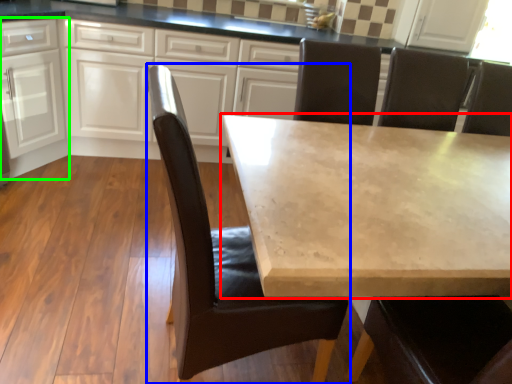
Question: Estimate the real-world distances between objects in this image. Which object is farther from table (highlighted by a red box), chair (highlighted by a blue box) or cabinetry (highlighted by a green box)?

Choices:
 (A) chair
 (B) cabinetry

Answer: (B)